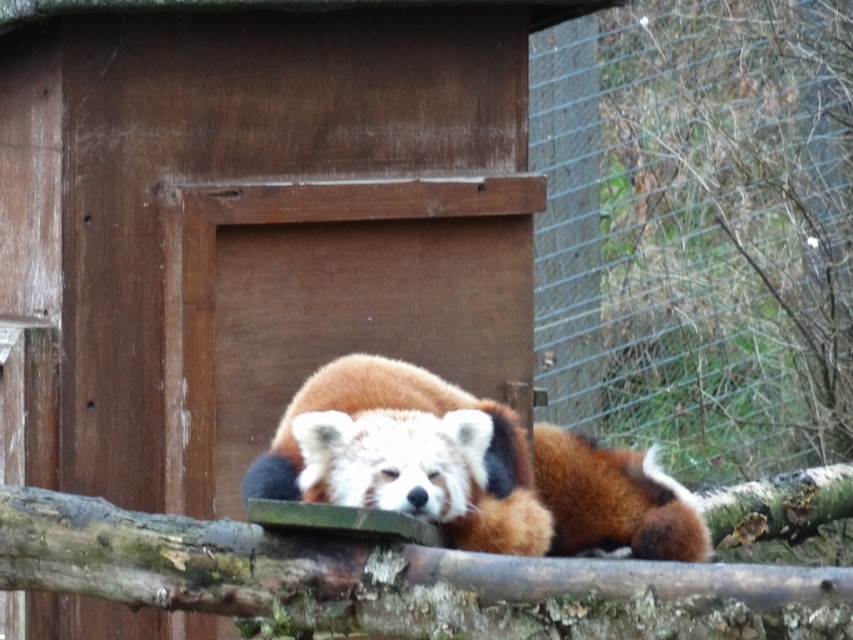
You are standing in front of the red panda enclosure and want to take a photo of the point at coordinates point (479, 589). If your camera has a maximum focus range of 3 meters, will you be able to focus on that point?

The point (479, 589) is 3.02 meters from the viewer, which is slightly beyond the camera maximum focus range of 3 meters. Therefore, the camera may not be able to focus on that point.

You are a photographer standing in front of the brown rough wood at center where the red panda is resting. You want to take a closeup photo of the red panda without moving the animal. Can you get a clear closeup shot from your current position? Explain why or why not.

The brown rough wood at center is 2.61 meters from camera. To take a clear closeup photo of the red panda resting there, you would need a zoom lens capable of focusing at that distance. If your camera has sufficient zoom, you can capture the closeup without moving closer.